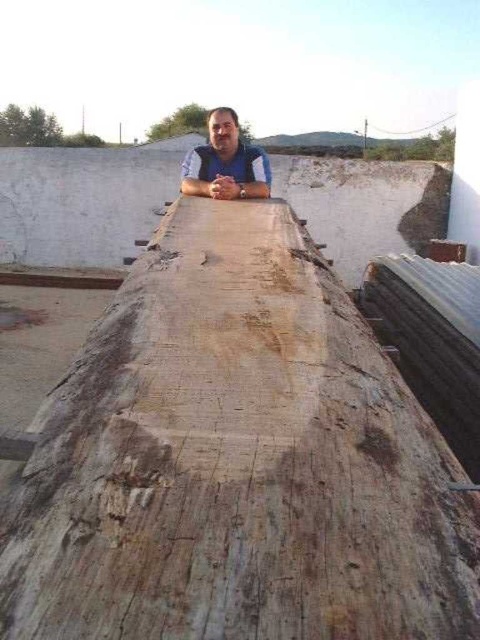
Who is more distant from viewer, [307,440] or [240,195]?

The point [240,195] is more distant.

Does weathered wood at center appear on the left side of blue matte shirt at center?

In fact, weathered wood at center is to the right of blue matte shirt at center.

Does point (204, 301) lie in front of point (211, 163)?

Yes, it is.

This screenshot has height=640, width=480. In order to click on weathered wood at center in this screenshot , I will do `click(236, 461)`.